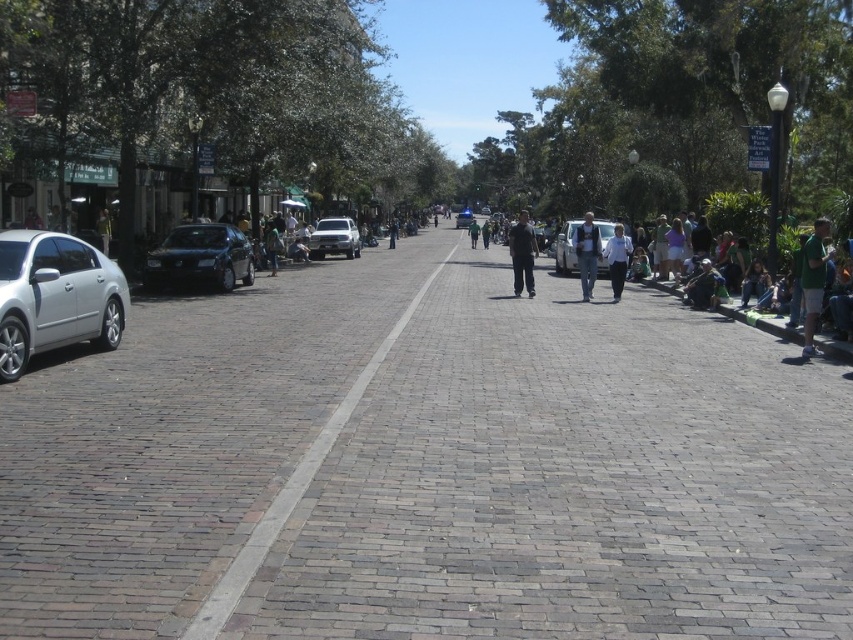
Question: Is shiny black sedan at left wider than denim jacket at center?

Choices:
 (A) no
 (B) yes

Answer: (A)

Question: Observing the image, what is the correct spatial positioning of satin silver sedan at left in reference to white matte car at center?

Choices:
 (A) below
 (B) above

Answer: (A)

Question: Which object is closer to the camera taking this photo?

Choices:
 (A) brick road at center
 (B) shiny black sedan at left

Answer: (A)

Question: Which object appears farthest from the camera in this image?

Choices:
 (A) silver metallic truck at center
 (B) brick road at center
 (C) white cotton shirt at center

Answer: (A)

Question: Is shiny black sedan at left thinner than metallic silver sedan at center?

Choices:
 (A) yes
 (B) no

Answer: (A)

Question: Which point is farther from the camera taking this photo?

Choices:
 (A) (416, 300)
 (B) (74, 257)
 (C) (595, 237)
 (D) (815, 262)

Answer: (C)